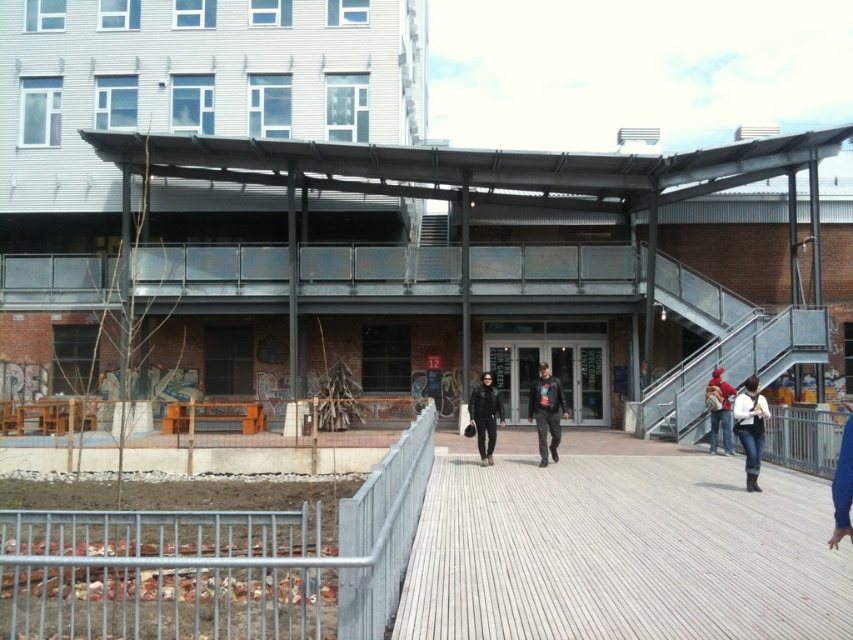
At what (x,y) coordinates should I click in order to perform the action: click on white matte jacket at lower right. Please return your answer as a coordinate pair (x, y). Looking at the image, I should click on (750, 428).

Looking at this image, is white matte jacket at lower right taller than leather jacket at center?

No, white matte jacket at lower right is not taller than leather jacket at center.

Identify the location of white matte jacket at lower right. This screenshot has width=853, height=640. (750, 428).

Does wooden planks at center have a lesser height compared to matte red backpack at center?

Yes, wooden planks at center is shorter than matte red backpack at center.

Does point (611, 630) come closer to viewer compared to point (706, 400)?

That is True.

This screenshot has height=640, width=853. I want to click on wooden planks at center, so click(622, 552).

The image size is (853, 640). I want to click on wooden planks at center, so click(622, 552).

Does point (654, 627) come in front of point (755, 401)?

Yes.

How distant is wooden planks at center from white matte jacket at lower right?

9.73 feet

Who is more distant from viewer, (718,528) or (753,378)?

Positioned behind is point (753,378).

You are a GUI agent. You are given a task and a screenshot of the screen. Output one action in this format:
    pyautogui.click(x=<x>, y=<y>)
    Task: Click on the wooden planks at center
    
    Given the screenshot: What is the action you would take?
    pyautogui.click(x=622, y=552)